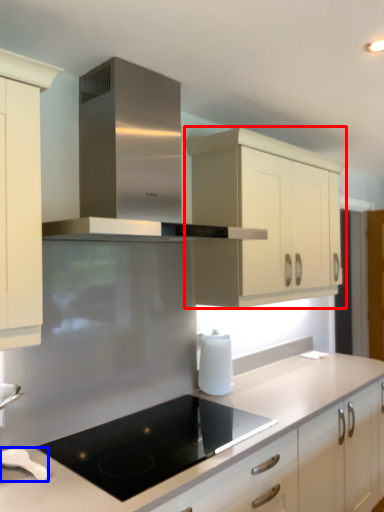
Question: Which of the following is the farthest to the observer, cabinetry (highlighted by a red box) or kitchen appliance (highlighted by a blue box)?

Choices:
 (A) cabinetry
 (B) kitchen appliance

Answer: (A)